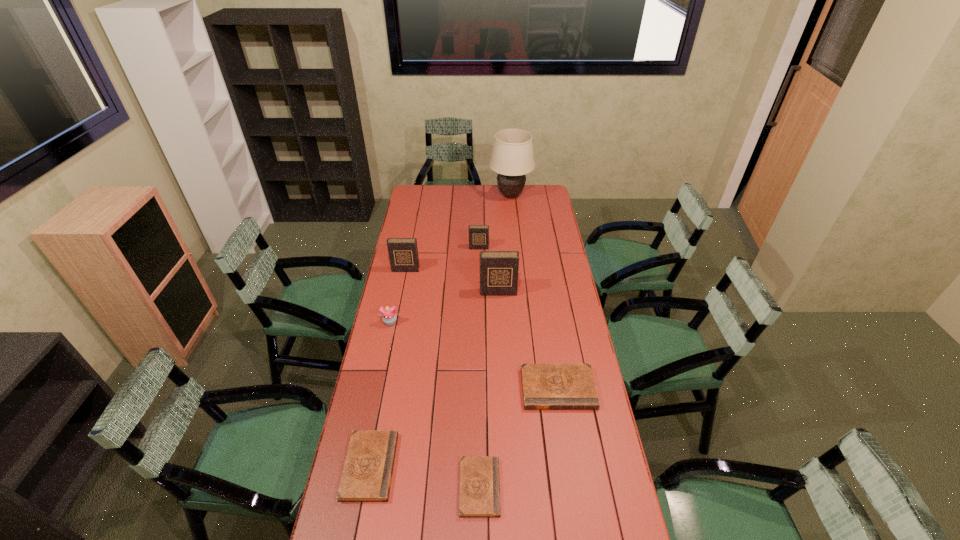
The image size is (960, 540). I want to click on free space between the seventh shortest object and the shortest diary, so click(489, 389).

Identify which object is the third nearest to the third tallest object. Please provide its 2D coordinates. Your answer should be formatted as a tuple, i.e. [(x, y)], where the tuple contains the x and y coordinates of a point satisfying the conditions above.

[(499, 270)]

This screenshot has width=960, height=540. I want to click on the closest object to the tallest object, so click(x=478, y=234).

Locate which diary ranks fifth in proximity to the farthest object. Please provide its 2D coordinates. Your answer should be formatted as a tuple, i.e. [(x, y)], where the tuple contains the x and y coordinates of a point satisfying the conditions above.

[(367, 473)]

Locate which diary is the fourth closest to the second shortest diary. Please provide its 2D coordinates. Your answer should be formatted as a tuple, i.e. [(x, y)], where the tuple contains the x and y coordinates of a point satisfying the conditions above.

[(403, 253)]

Find the location of a particular element. dark diary that stands as the second closest to the third shortest object is located at coordinates (403, 253).

The height and width of the screenshot is (540, 960). I want to click on the third closest dark diary relative to the tallest object, so click(x=499, y=270).

Identify the location of brown diary that is the closest one to the cupcake. (367, 473).

I want to click on the third closest brown diary to the farthest dark diary, so click(x=479, y=496).

In order to click on vacant space that satisfies the following two spatial constraints: 1. on the spine side of the rightmost brown diary; 2. on the spine side of the second shortest object in this screenshot , I will do `click(570, 466)`.